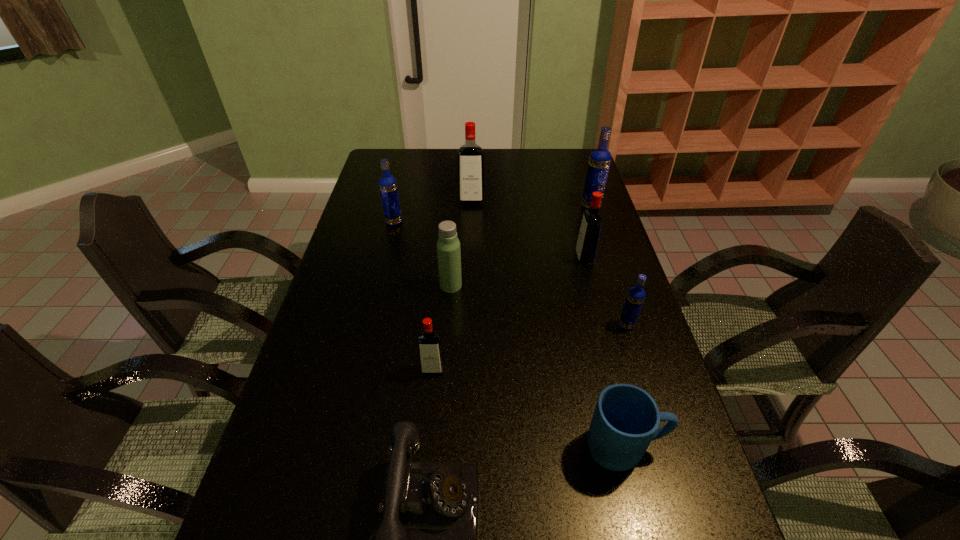
Find the location of a particular element. The height and width of the screenshot is (540, 960). the farthest blue vodka is located at coordinates (600, 158).

This screenshot has width=960, height=540. What are the coordinates of `the second red vodka from right to left` in the screenshot? It's located at (470, 157).

Find the location of `the farthest red vodka`. the farthest red vodka is located at coordinates (470, 157).

In order to click on the leftmost vodka in this screenshot , I will do `click(388, 186)`.

At what (x,y) coordinates should I click in order to perform the action: click on the leftmost object. Please return your answer as a coordinate pair (x, y). The image size is (960, 540). Looking at the image, I should click on (388, 186).

Locate an element on the screen. Image resolution: width=960 pixels, height=540 pixels. the rightmost red vodka is located at coordinates point(587,243).

This screenshot has height=540, width=960. What are the coordinates of `the second farthest red vodka` in the screenshot? It's located at (587, 243).

Locate an element on the screen. Image resolution: width=960 pixels, height=540 pixels. thermos bottle is located at coordinates (448, 245).

This screenshot has width=960, height=540. In order to click on light thermos bottle in this screenshot , I will do `click(448, 245)`.

Find the location of a particular element. This screenshot has width=960, height=540. the second nearest vodka is located at coordinates (636, 295).